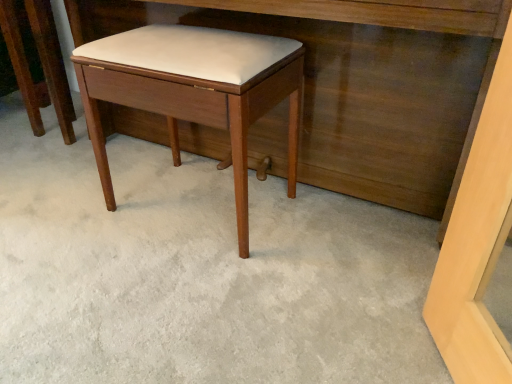
Question: Does matte wood stool at center have a smaller size compared to matte wood stool at center?

Choices:
 (A) no
 (B) yes

Answer: (A)

Question: Is matte wood stool at center wider than matte wood stool at center?

Choices:
 (A) yes
 (B) no

Answer: (A)

Question: Does matte wood stool at center have a lesser width compared to matte wood stool at center?

Choices:
 (A) no
 (B) yes

Answer: (A)

Question: From the image's perspective, is matte wood stool at center on top of matte wood stool at center?

Choices:
 (A) no
 (B) yes

Answer: (A)

Question: Is matte wood stool at center shorter than matte wood stool at center?

Choices:
 (A) no
 (B) yes

Answer: (B)

Question: Can you see matte wood stool at center touching matte wood stool at center?

Choices:
 (A) yes
 (B) no

Answer: (B)

Question: Is matte wood stool at center located outside matte wood vanity at center?

Choices:
 (A) no
 (B) yes

Answer: (B)

Question: From a real-world perspective, is matte wood stool at center over matte wood vanity at center?

Choices:
 (A) no
 (B) yes

Answer: (A)

Question: Does matte wood stool at center have a greater width compared to matte wood vanity at center?

Choices:
 (A) no
 (B) yes

Answer: (A)

Question: Would you say matte wood stool at center is a long distance from matte wood vanity at center?

Choices:
 (A) yes
 (B) no

Answer: (B)

Question: From a real-world perspective, is matte wood stool at center under matte wood vanity at center?

Choices:
 (A) yes
 (B) no

Answer: (A)

Question: Is matte wood stool at center bigger than matte wood vanity at center?

Choices:
 (A) yes
 (B) no

Answer: (B)

Question: Does matte wood vanity at center have a larger size compared to matte wood stool at center?

Choices:
 (A) no
 (B) yes

Answer: (B)